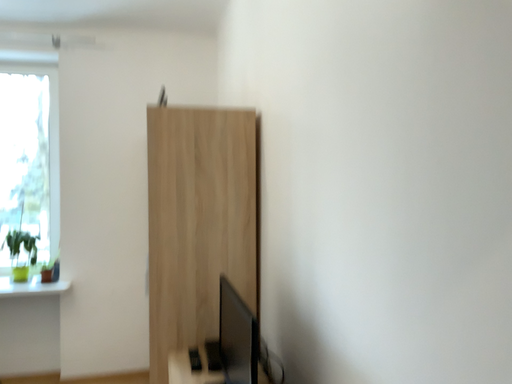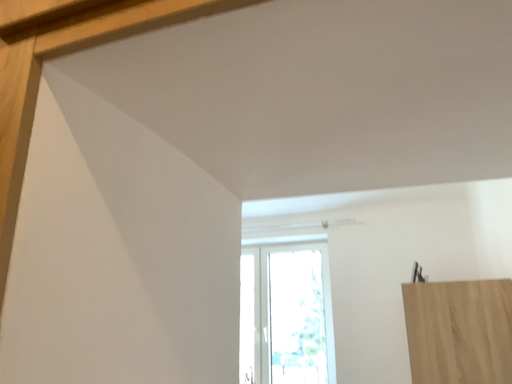
Question: Which way did the camera rotate in the video?

Choices:
 (A) rotated upward
 (B) rotated downward

Answer: (A)